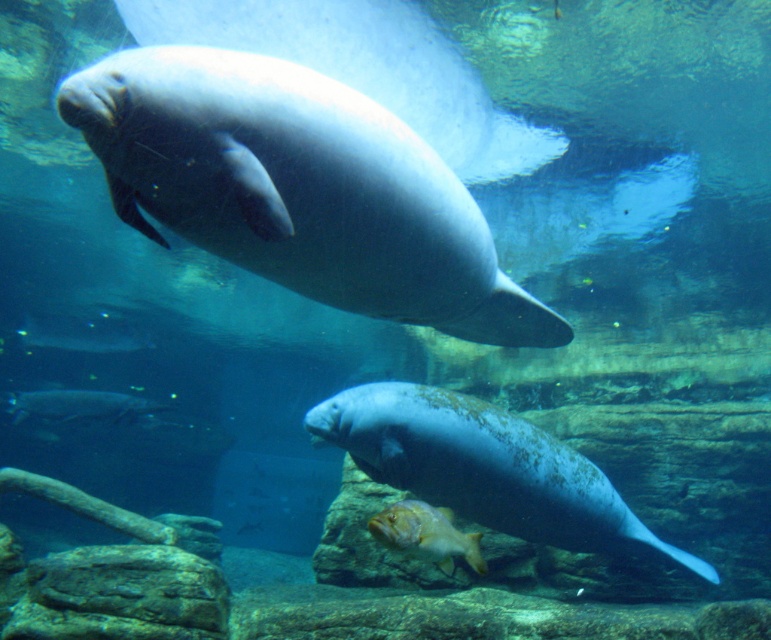
Question: Does speckled gray fish at lower center have a larger size compared to shiny golden fish at lower center?

Choices:
 (A) yes
 (B) no

Answer: (A)

Question: Does shiny golden fish at lower center appear on the right side of silvery metallic fish at lower left?

Choices:
 (A) no
 (B) yes

Answer: (B)

Question: Which point is closer to the camera?

Choices:
 (A) speckled gray fish at lower center
 (B) shiny golden fish at lower center
 (C) silvery metallic fish at lower left

Answer: (B)

Question: Is smooth gray manatee at upper center wider than speckled gray fish at lower center?

Choices:
 (A) no
 (B) yes

Answer: (A)

Question: Which point appears closest to the camera in this image?

Choices:
 (A) (177, 202)
 (B) (106, 396)
 (C) (446, 465)
 (D) (396, 541)

Answer: (A)

Question: Estimate the real-world distances between objects in this image. Which object is closer to the smooth gray manatee at upper center?

Choices:
 (A) shiny golden fish at lower center
 (B) silvery metallic fish at lower left
 (C) speckled gray fish at lower center

Answer: (A)